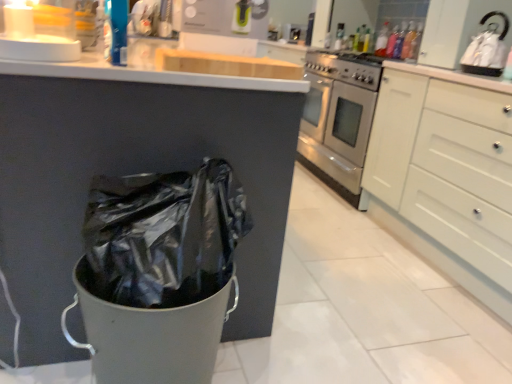
Question: Is matte white sink at upper center taller or shorter than translucent plastic bottle at upper right, which ranks as the second bottle in right-to-left order?

Choices:
 (A) tall
 (B) short

Answer: (B)

Question: From a real-world perspective, relative to translucent plastic bottle at upper right, which ranks as the second bottle in right-to-left order, is matte white sink at upper center vertically above or below?

Choices:
 (A) above
 (B) below

Answer: (B)

Question: Considering the real-world distances, which object is closest to the white matte cabinet at right?

Choices:
 (A) white glossy kettle at upper right
 (B) translucent plastic bottle at upper right, the first bottle viewed from the right
 (C) translucent plastic bottle at upper right, positioned as the 1th bottle in back-to-front order
 (D) matte white sink at upper center

Answer: (A)

Question: Which of these objects is positioned farthest from the white matte cabinet at right?

Choices:
 (A) white glossy kettle at upper right
 (B) translucent plastic bottle at upper right, the first bottle positioned from the front
 (C) translucent plastic bottle at upper right, positioned as the 1th bottle in back-to-front order
 (D) matte white sink at upper center

Answer: (D)